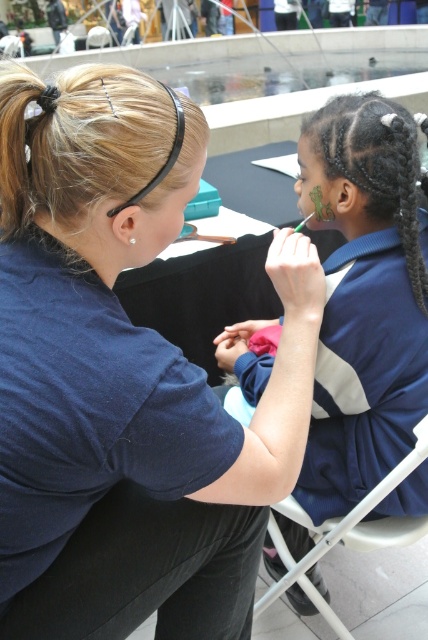
You are an event organizer at a festival and need to identify which blue shirt is closer to the attendees. You see the matte blue shirt at center and the blue fabric shirt at upper right. Which one is positioned closer to the attendees?

The matte blue shirt at center is positioned closer to the attendees because it is in front of the blue fabric shirt at upper right.

You are a photographer at the event and want to take a photo focusing on the matte blue shirt at center and the white plastic chair at lower right. Which object will appear larger in the photo?

The matte blue shirt at center will appear larger in the photo because it is closer to the viewer than the white plastic chair at lower right.